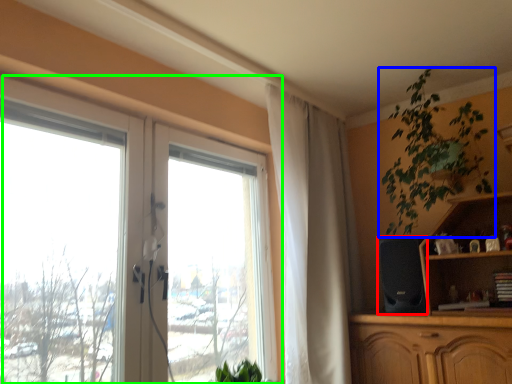
Question: Which is farther away from speaker (highlighted by a red box)? houseplant (highlighted by a blue box) or window (highlighted by a green box)?

Choices:
 (A) houseplant
 (B) window

Answer: (B)